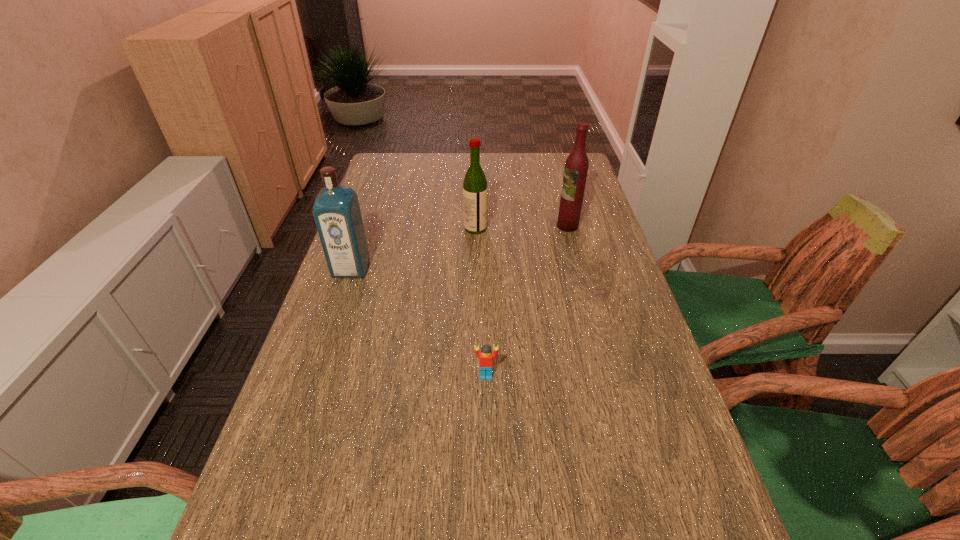
The image size is (960, 540). I want to click on liquor identified as the second closest to the shortest object, so click(475, 190).

Locate an element on the screen. The image size is (960, 540). vacant region that satisfies the following two spatial constraints: 1. on the label of the second liquor from right to left; 2. on the flat label side of the nearest liquor is located at coordinates (475, 269).

Identify the location of free space that satisfies the following two spatial constraints: 1. on the label of the rightmost liquor; 2. on the face of the nearest object. Image resolution: width=960 pixels, height=540 pixels. (607, 375).

The width and height of the screenshot is (960, 540). In order to click on vacant area that satisfies the following two spatial constraints: 1. on the label of the rightmost liquor; 2. on the face of the nearest object in this screenshot , I will do `click(607, 375)`.

Locate an element on the screen. free space that satisfies the following two spatial constraints: 1. on the label of the rightmost object; 2. on the flat label side of the leftmost object is located at coordinates (579, 269).

Identify the location of free point that satisfies the following two spatial constraints: 1. on the label of the second liquor from right to left; 2. on the flat label side of the nearest liquor. The width and height of the screenshot is (960, 540). (475, 269).